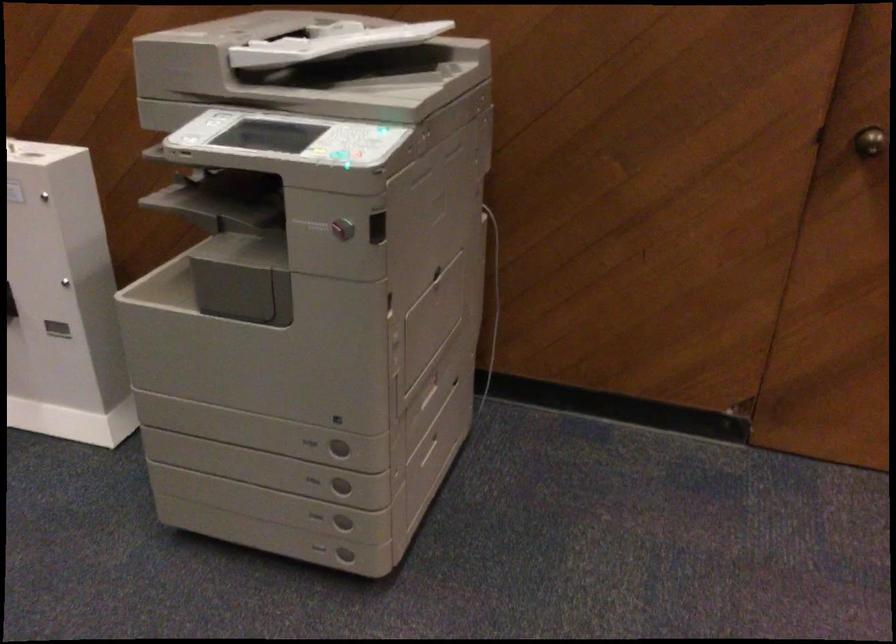
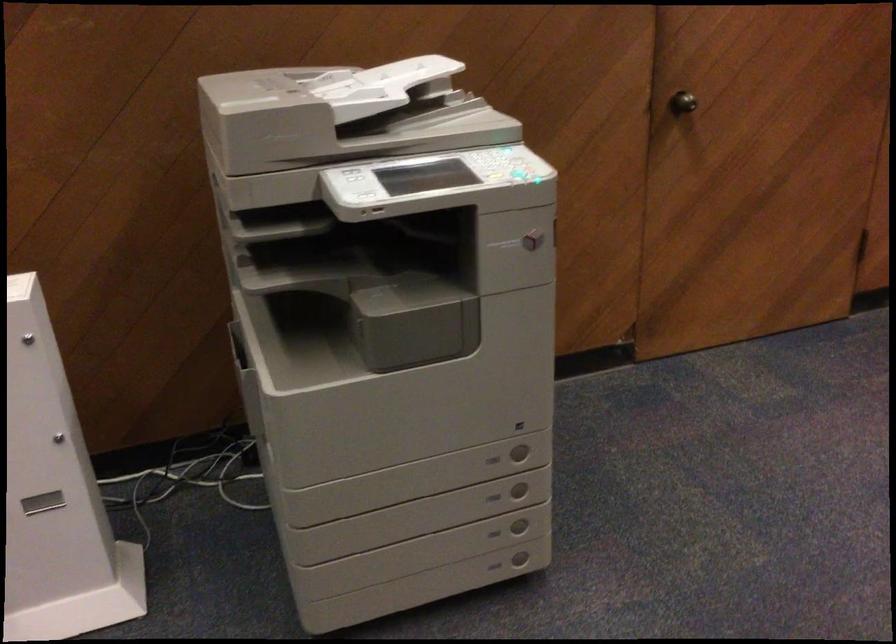
In the second image, find the point that corresponds to the point at 306,446 in the first image.

(492, 459)